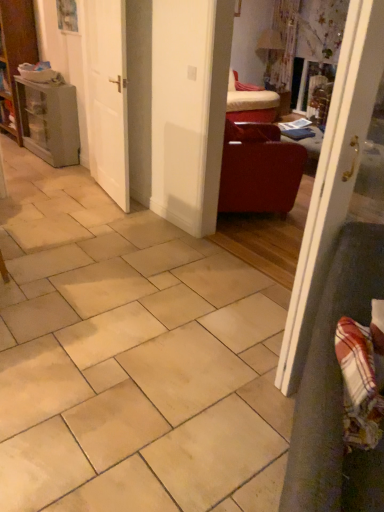
The height and width of the screenshot is (512, 384). Identify the location of vacant space to the left of white matte door at center, arranged as the 2th door when viewed from the front. (74, 197).